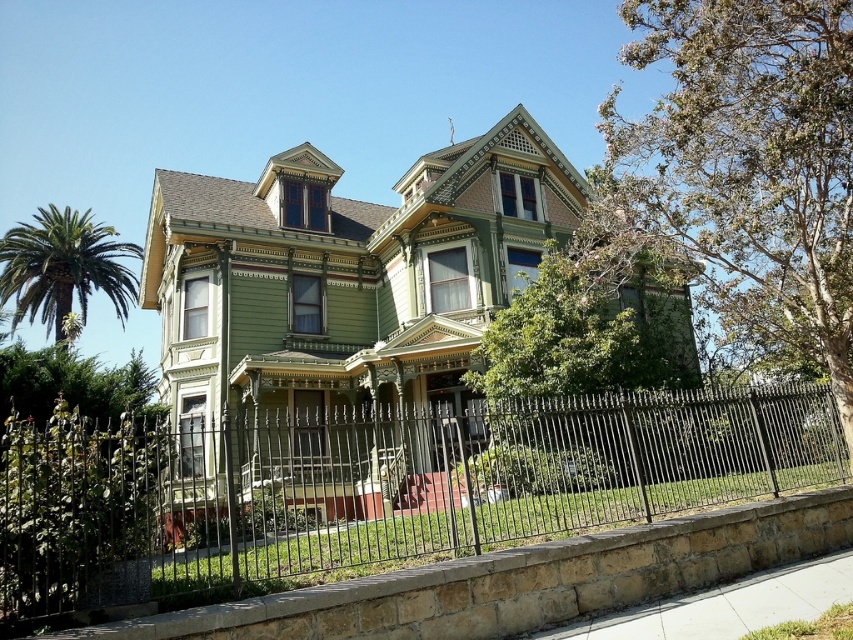
You are planning to install a new fence that matches the existing one. The current black wrought iron fence at center is narrower than the green leafy palm tree at left. If you want to maintain the same width as the palm tree, how much wider should the new fence be?

The black wrought iron fence at center has a lesser width compared to the green leafy palm tree at left, so the new fence should be wider by the difference between their widths to match the palm tree.

You are standing in front of the Victorian house and want to take a photo. You notice two points marked on the image. Which point, point 1 at coordinates [518,435] or point 2 at coordinates [61,291], is closer to your camera lens?

Point 1 at coordinates [518,435] is closer to the camera lens than point 2 at coordinates [61,291].